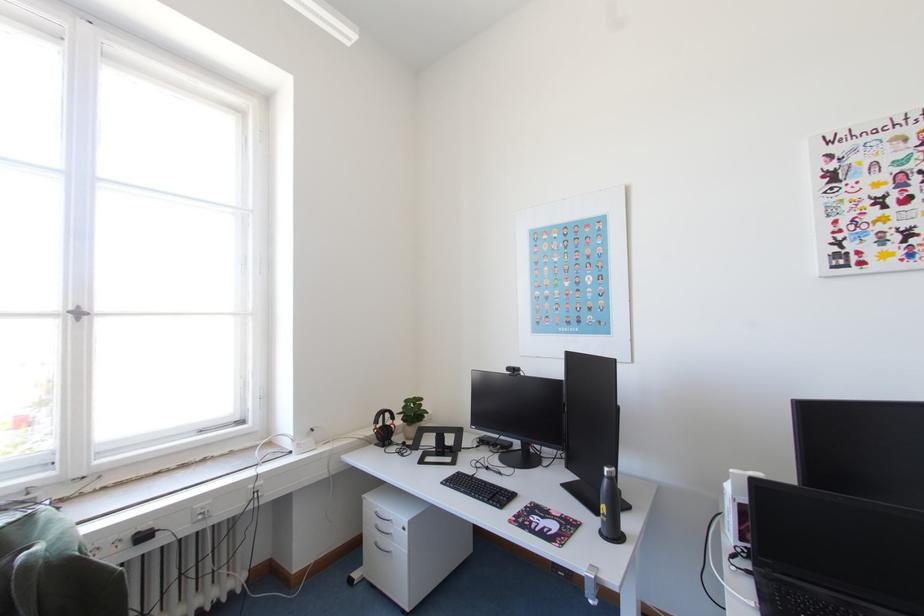
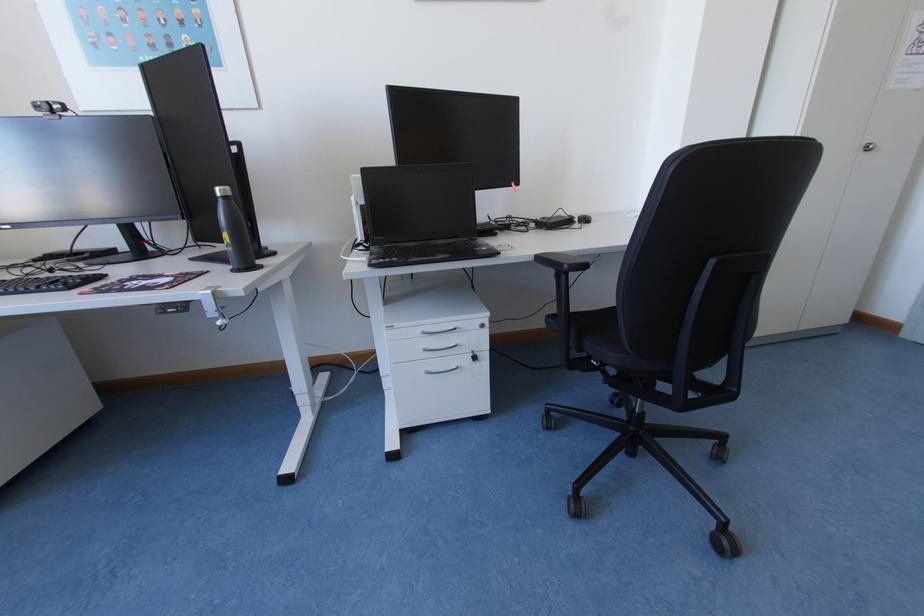
How did the camera likely rotate?

The rotation direction of the camera is right-down.